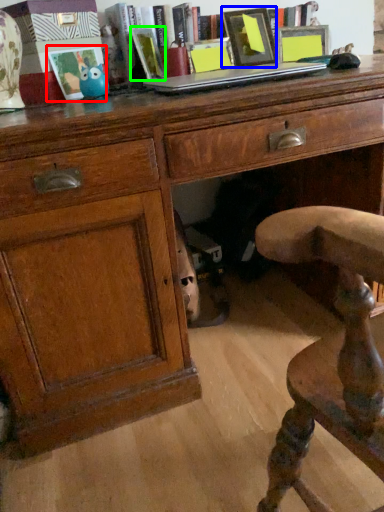
Question: Which object is positioned farthest from picture frame (highlighted by a red box)? Select from picture frame (highlighted by a blue box) and book (highlighted by a green box).

Choices:
 (A) picture frame
 (B) book

Answer: (A)